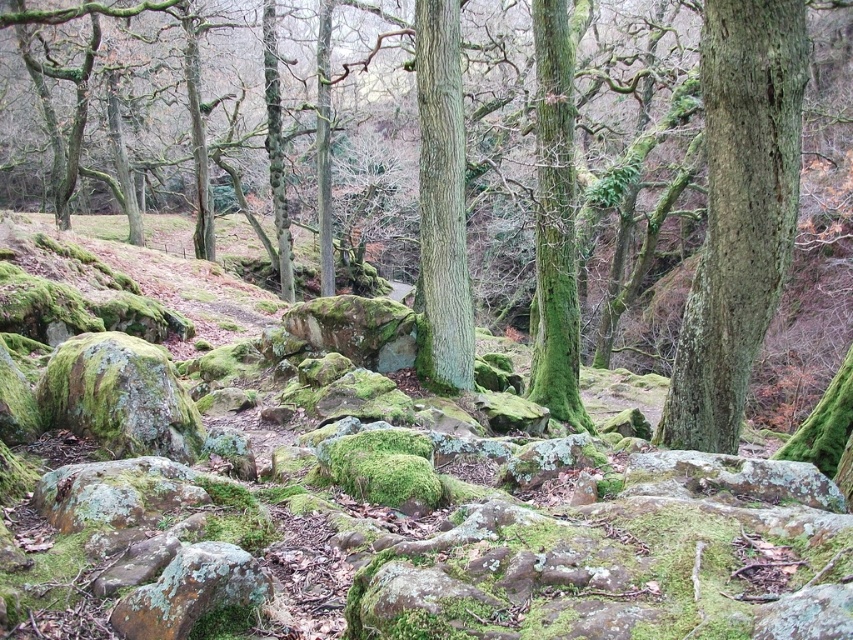
Question: Which of the following is the closest to the observer?

Choices:
 (A) (714, 321)
 (B) (170, 582)
 (C) (733, 372)
 (D) (456, 99)

Answer: (B)

Question: Is green rough bark tree at right above green mossy tree at center?

Choices:
 (A) yes
 (B) no

Answer: (B)

Question: Observing the image, what is the correct spatial positioning of green mossy rock at center in reference to green mossy tree at center?

Choices:
 (A) left
 (B) right

Answer: (A)

Question: Is green rough bark tree at center thinner than green mossy rock at lower left?

Choices:
 (A) no
 (B) yes

Answer: (A)

Question: Among these objects, which one is nearest to the camera?

Choices:
 (A) green rough bark tree at center
 (B) green mossy tree at center
 (C) green mossy rock at center
 (D) green rough bark tree at right

Answer: (C)

Question: Among these points, which one is farthest from the camera?

Choices:
 (A) (426, 156)
 (B) (181, 572)
 (C) (706, 38)

Answer: (A)